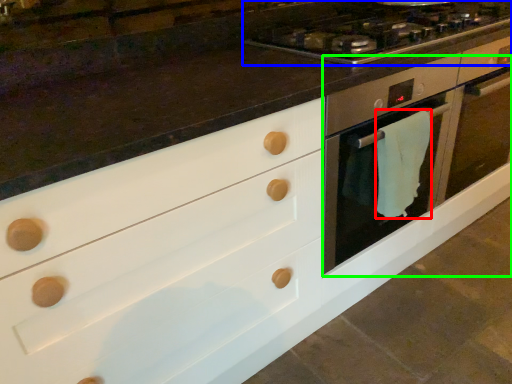
Question: Based on their relative distances, which object is farther from material (highlighted by a red box)? Choose from gas stove (highlighted by a blue box) and oven (highlighted by a green box).

Choices:
 (A) gas stove
 (B) oven

Answer: (A)